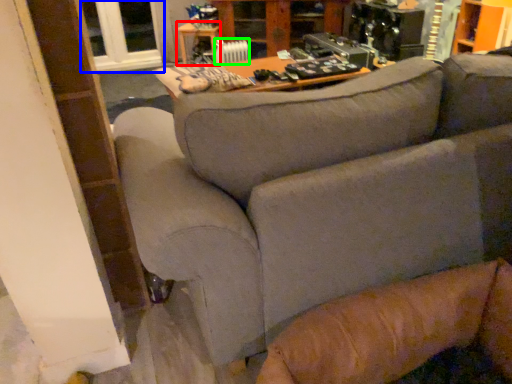
Question: Considering the real-world distances, which object is closest to table (highlighted by a red box)? window (highlighted by a blue box) or radiator (highlighted by a green box).

Choices:
 (A) window
 (B) radiator

Answer: (A)